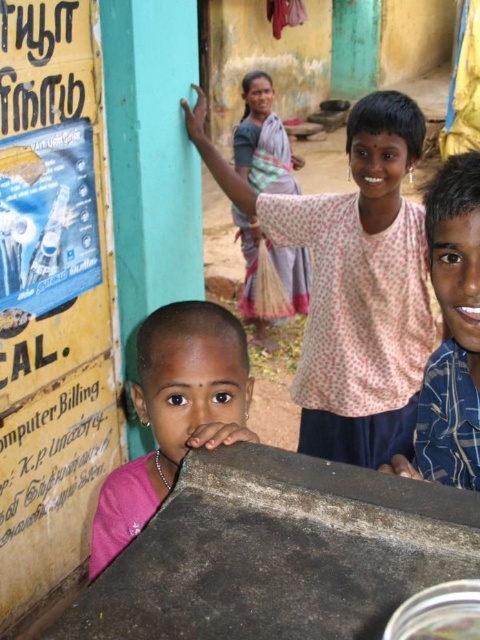
Question: Is pink fabric at upper center wider than blue plaid shirt at upper right?

Choices:
 (A) yes
 (B) no

Answer: (A)

Question: Does yellow paper at left appear over pink fabric at center?

Choices:
 (A) no
 (B) yes

Answer: (B)

Question: Which object is the farthest from the yellow paper at left?

Choices:
 (A) pink fabric at upper center
 (B) blue plaid shirt at upper right

Answer: (B)

Question: In this image, where is pink fabric at center located relative to blue plaid shirt at upper right?

Choices:
 (A) right
 (B) left

Answer: (B)

Question: Estimate the real-world distances between objects in this image. Which object is farther from the yellow paper at left?

Choices:
 (A) pink fabric at upper center
 (B) blue plaid shirt at upper right
 (C) pink fabric at center

Answer: (B)

Question: Which point is farther from the camera taking this photo?

Choices:
 (A) (462, 285)
 (B) (192, 120)

Answer: (B)